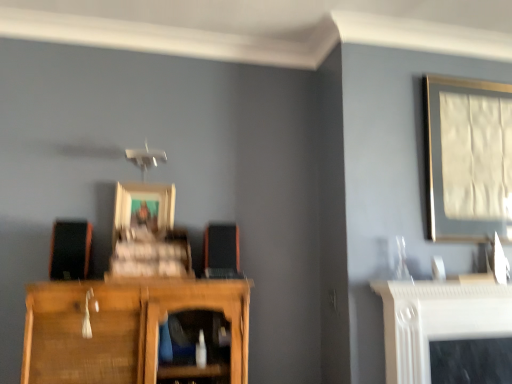
Question: In the image, is matte black speaker at left, acting as the first speaker starting from the left, positioned in front of or behind matte silver picture frame at upper right, arranged as the 1th picture frame when viewed from the right?

Choices:
 (A) front
 (B) behind

Answer: (A)

Question: Does point (69, 259) appear closer or farther from the camera than point (473, 155)?

Choices:
 (A) closer
 (B) farther

Answer: (A)

Question: Which of these objects is positioned closest to the wooden cupboard at lower left?

Choices:
 (A) matte black speaker at left, the second speaker in the right-to-left sequence
 (B) wooden picture frame at center, placed as the first picture frame when sorted from left to right
 (C) matte silver picture frame at upper right, arranged as the 1th picture frame when viewed from the right
 (D) orange matte speaker at center, the 2th speaker in the left-to-right sequence

Answer: (A)

Question: Estimate the real-world distances between objects in this image. Which object is farther from the matte silver picture frame at upper right, the second picture frame when ordered from left to right?

Choices:
 (A) wooden cupboard at lower left
 (B) matte black speaker at left, the second speaker in the right-to-left sequence
 (C) wooden picture frame at center, which ranks as the 2th picture frame in right-to-left order
 (D) orange matte speaker at center, which ranks as the first speaker in right-to-left order

Answer: (B)